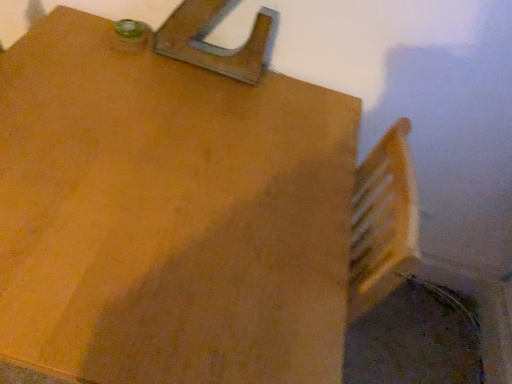
You are a GUI agent. You are given a task and a screenshot of the screen. Output one action in this format:
    pyautogui.click(x=<x>, y=<y>)
    Task: Click on the wooden at upper center
    
    Given the screenshot: What is the action you would take?
    pyautogui.click(x=215, y=45)

This screenshot has width=512, height=384. Describe the element at coordinates (215, 45) in the screenshot. I see `wooden at upper center` at that location.

Measure the distance between point (172,379) and camera.

They are 25.24 inches apart.

You are a GUI agent. You are given a task and a screenshot of the screen. Output one action in this format:
    pyautogui.click(x=<x>, y=<y>)
    Task: Click on the matte wood table at upper left
    
    Given the screenshot: What is the action you would take?
    pyautogui.click(x=169, y=216)

The width and height of the screenshot is (512, 384). What do you see at coordinates (169, 216) in the screenshot?
I see `matte wood table at upper left` at bounding box center [169, 216].

The image size is (512, 384). Identify the location of wooden at upper center. pyautogui.click(x=215, y=45).

Considering the relative positions of matte wood table at upper left and wooden at upper center in the image provided, is matte wood table at upper left to the left of wooden at upper center from the viewer's perspective?

Correct, you'll find matte wood table at upper left to the left of wooden at upper center.

Which is in front, matte wood table at upper left or wooden at upper center?

matte wood table at upper left is in front.

Considering the positions of points (156, 320) and (184, 8), is point (156, 320) farther from camera compared to point (184, 8)?

No, (156, 320) is in front of (184, 8).

From the image's perspective, which object appears higher, matte wood table at upper left or wooden at upper center?

wooden at upper center.

Based on the photo, from a real-world perspective, which object rests below the other?

matte wood table at upper left, from a real-world perspective.

Can you confirm if matte wood table at upper left is thinner than wooden at upper center?

Incorrect, the width of matte wood table at upper left is not less than that of wooden at upper center.

Who is shorter, matte wood table at upper left or wooden at upper center?

wooden at upper center is shorter.

Is matte wood table at upper left bigger than wooden at upper center?

Yes.

Would you say matte wood table at upper left is inside or outside wooden at upper center?

The correct answer is: outside.

Looking at this image, are matte wood table at upper left and wooden at upper center located far from each other?

No.

Is matte wood table at upper left turned away from wooden at upper center?

No, matte wood table at upper left is not facing the opposite direction of wooden at upper center.

Can you tell me how much matte wood table at upper left and wooden at upper center differ in facing direction?

matte wood table at upper left and wooden at upper center are facing 1.79 degrees away from each other.

This screenshot has height=384, width=512. Identify the location of latch behind the matte wood table at upper left. (215, 45).

Which object is positioned more to the right, wooden at upper center or matte wood table at upper left?

wooden at upper center.

Considering the relative positions of wooden at upper center and matte wood table at upper left in the image provided, is wooden at upper center behind matte wood table at upper left?

That is True.

Which is more distant, (232,1) or (69,260)?

Positioned behind is point (232,1).

From the image's perspective, who appears lower, wooden at upper center or matte wood table at upper left?

matte wood table at upper left appears lower in the image.

From a real-world perspective, which is physically above, wooden at upper center or matte wood table at upper left?

wooden at upper center, from a real-world perspective.

Can you confirm if wooden at upper center is thinner than matte wood table at upper left?

Yes.

Who is shorter, wooden at upper center or matte wood table at upper left?

Standing shorter between the two is wooden at upper center.

Is wooden at upper center bigger or smaller than matte wood table at upper left?

wooden at upper center is smaller than matte wood table at upper left.

Is wooden at upper center outside of matte wood table at upper left?

Yes, wooden at upper center is outside of matte wood table at upper left.

Is wooden at upper center not near matte wood table at upper left?

No, wooden at upper center is in close proximity to matte wood table at upper left.

Is wooden at upper center facing away from matte wood table at upper left?

wooden at upper center is not turned away from matte wood table at upper left.

From the picture: What's the angular difference between wooden at upper center and matte wood table at upper left's facing directions?

1.79 degrees.

The height and width of the screenshot is (384, 512). I want to click on latch that is behind the matte wood table at upper left, so click(215, 45).

Locate an element on the screen. table lying on the left of wooden at upper center is located at coordinates (169, 216).

Locate an element on the screen. The width and height of the screenshot is (512, 384). latch above the matte wood table at upper left (from a real-world perspective) is located at coordinates (215, 45).